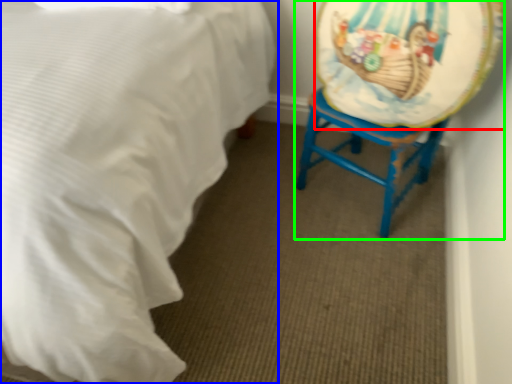
Question: Which is farther away from platter (highlighted by a red box)? bed (highlighted by a blue box) or swivel chair (highlighted by a green box)?

Choices:
 (A) bed
 (B) swivel chair

Answer: (A)